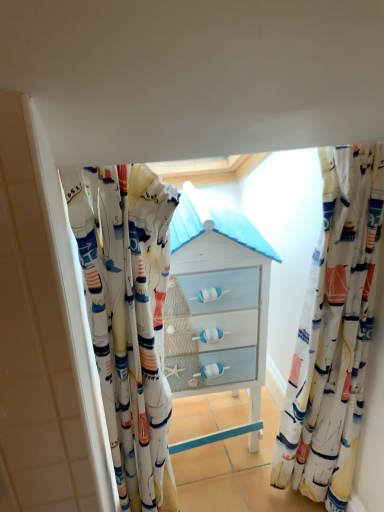
Question: Does point (158, 492) appear closer or farther from the camera than point (377, 158)?

Choices:
 (A) farther
 (B) closer

Answer: (A)

Question: From a real-world perspective, relative to sailboat-patterned fabric at right, which ranks as the second curtain in left-to-right order, is white fabric curtain at center, placed as the 2th curtain when sorted from right to left, vertically above or below?

Choices:
 (A) above
 (B) below

Answer: (B)

Question: Estimate the real-world distances between objects in this image. Which object is farther from the matte white chest of drawers at center?

Choices:
 (A) sailboat-patterned fabric at right, which ranks as the second curtain in left-to-right order
 (B) white fabric curtain at center, marked as the 1th curtain in a left-to-right arrangement

Answer: (A)

Question: Based on their relative distances, which object is farther from the matte white chest of drawers at center?

Choices:
 (A) white fabric curtain at center, placed as the 2th curtain when sorted from right to left
 (B) sailboat-patterned fabric at right, which appears as the 1th curtain when viewed from the right

Answer: (B)